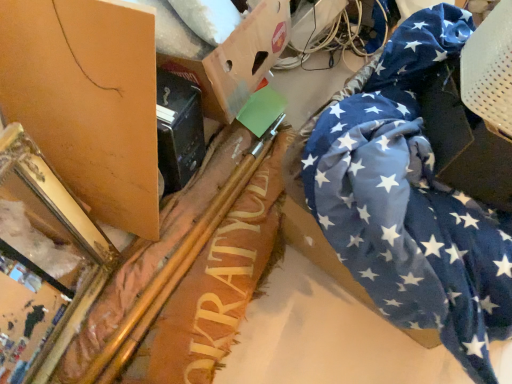
Question: Visually, is green plastic wire at upper center positioned to the left or to the right of blue fabric at right, marked as the 3th cardboard box in a left-to-right arrangement?

Choices:
 (A) left
 (B) right

Answer: (A)

Question: Is point (323, 6) positioned closer to the camera than point (509, 72)?

Choices:
 (A) farther
 (B) closer

Answer: (A)

Question: Which of these objects is positioned closest to the blue star-patterned fabric at right?

Choices:
 (A) green plastic wire at upper center
 (B) blue fabric at right, marked as the 3th cardboard box in a left-to-right arrangement
 (C) matte brown cardboard at upper left, which appears as the third cardboard box when viewed from the right
 (D) gold metallic mirror at left
 (E) white perforated plastic swivel chair at upper right

Answer: (B)

Question: Estimate the real-world distances between objects in this image. Which object is closer to the blue fabric at right, marked as the 3th cardboard box in a left-to-right arrangement?

Choices:
 (A) green plastic wire at upper center
 (B) gold metallic mirror at left
 (C) blue star-patterned fabric at right
 (D) cardboard box at upper center, the second cardboard box when ordered from left to right
 (E) matte brown cardboard at upper left, which appears as the third cardboard box when viewed from the right

Answer: (C)